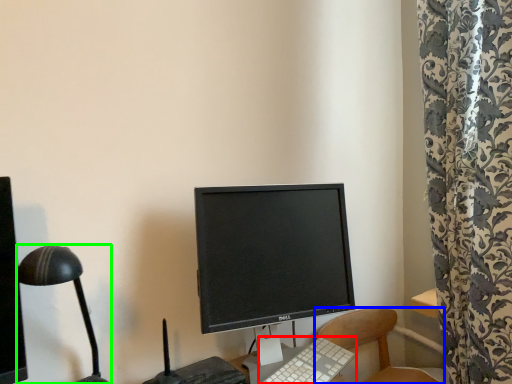
Question: Which is nearer to the computer keyboard (highlighted by a red box)? chair (highlighted by a blue box) or lamp (highlighted by a green box).

Choices:
 (A) chair
 (B) lamp

Answer: (A)